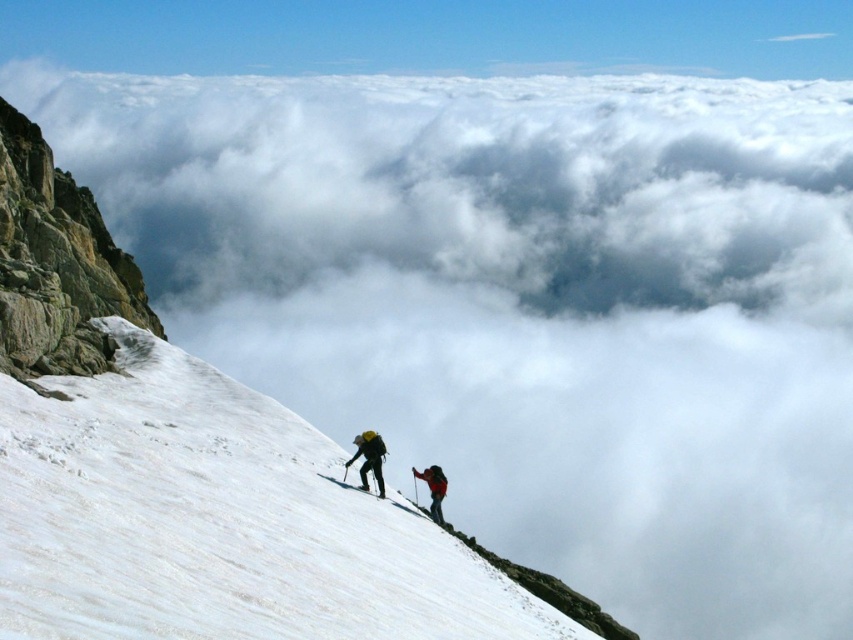
Question: Can you confirm if white matte ski at lower center is positioned above black matte ski at lower center?

Choices:
 (A) yes
 (B) no

Answer: (A)

Question: Does red fabric backpack at center have a larger size compared to white matte ski at lower center?

Choices:
 (A) yes
 (B) no

Answer: (A)

Question: Which object is closer to the camera taking this photo?

Choices:
 (A) red fabric backpack at center
 (B) white matte ski at lower center
 (C) black matte ski at lower center
 (D) matte black backpack at center

Answer: (B)

Question: Which point is closer to the camera?

Choices:
 (A) black matte ski at lower center
 (B) red fabric backpack at center
 (C) white matte ski at lower center

Answer: (C)

Question: Can you confirm if red fabric backpack at center is positioned to the right of black matte ski at lower center?

Choices:
 (A) yes
 (B) no

Answer: (A)

Question: Among these points, which one is farthest from the camera?

Choices:
 (A) pos(379,492)
 (B) pos(381,481)

Answer: (B)